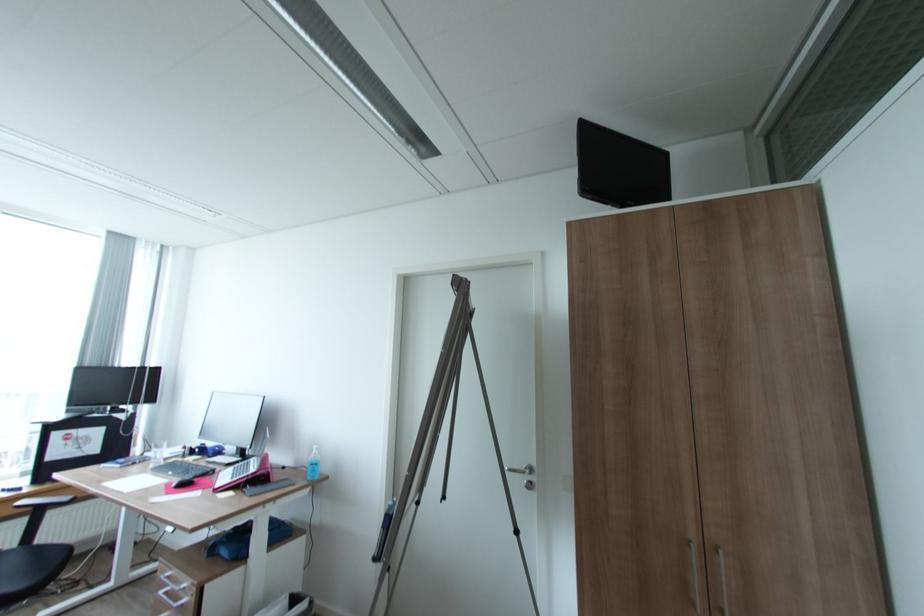
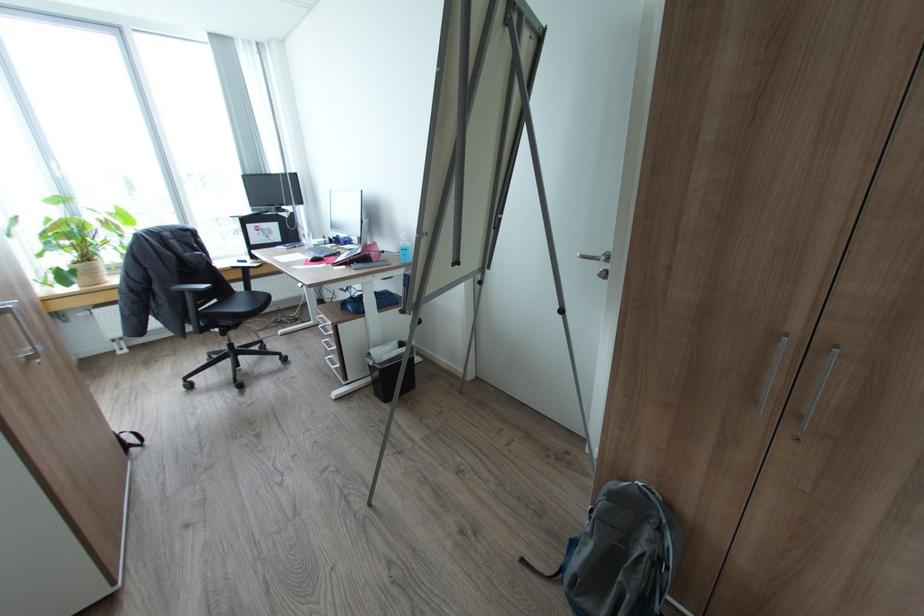
In the second image, find the point that corresponds to point (178, 485) in the first image.

(314, 259)